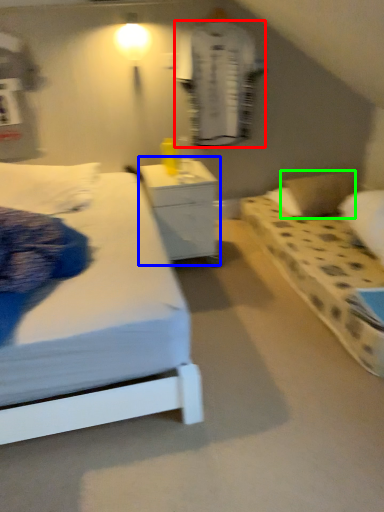
Question: Which object is the farthest from robe (highlighted by a red box)? Choose among these: nightstand (highlighted by a blue box) or pillow (highlighted by a green box).

Choices:
 (A) nightstand
 (B) pillow

Answer: (B)